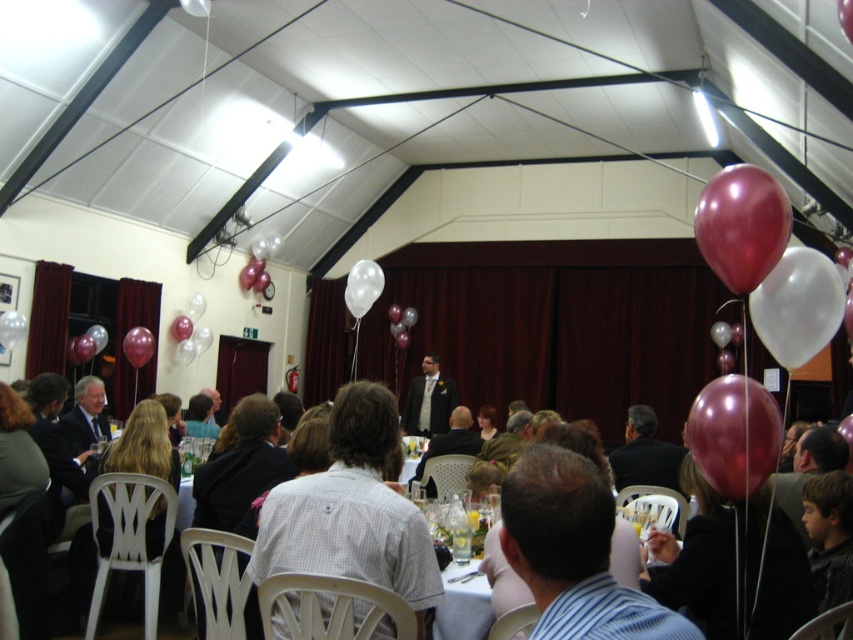
Measure the distance from white glossy balloon at center to metallic pink balloon at left.

They are 8.26 feet apart.

Between point (373, 296) and point (146, 356), which one is positioned in front?

Point (373, 296)

Image resolution: width=853 pixels, height=640 pixels. Find the location of `white glossy balloon at center`. white glossy balloon at center is located at coordinates (363, 285).

Can you confirm if white textured shirt at center is thinner than matte black suit at center?

Correct, white textured shirt at center's width is less than matte black suit at center's.

Who is higher up, white textured shirt at center or matte black suit at center?

Positioned higher is white textured shirt at center.

Identify the location of white textured shirt at center. (351, 509).

Image resolution: width=853 pixels, height=640 pixels. What do you see at coordinates (734, 435) in the screenshot?
I see `metallic red balloon at right` at bounding box center [734, 435].

You are a GUI agent. You are given a task and a screenshot of the screen. Output one action in this format:
    pyautogui.click(x=<x>, y=<y>)
    Task: Click on the metallic red balloon at right
    
    Given the screenshot: What is the action you would take?
    pyautogui.click(x=734, y=435)